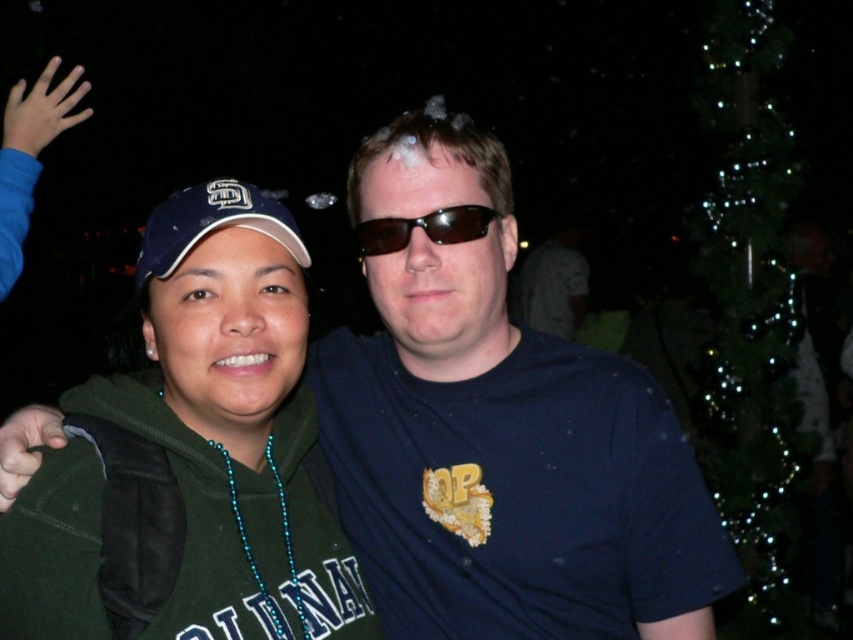
You are standing in front of the image. There is a point at coordinate (500, 435). Which object in the image is located at this coordinate?

The dark blue t shirt at center is located at coordinate point (500, 435).

Based on the photo, you are a photographer trying to adjust the lighting for a portrait. You notice the green matte hoodie at center and the matte blue baseball cap at left in your frame. Based on their positions, which object should you focus on first if you want to ensure both are well lit?

The green matte hoodie at center is to the left of the matte blue baseball cap at left. Since the hoodie is positioned further left, you should focus on the green matte hoodie at center first to ensure proper lighting before adjusting for the cap on the right side.